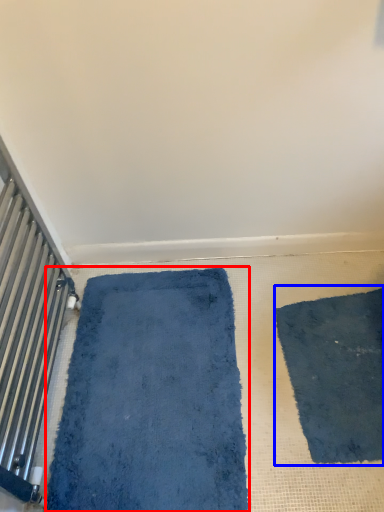
Question: Which object is further to the camera taking this photo, bath mat (highlighted by a red box) or mat (highlighted by a blue box)?

Choices:
 (A) bath mat
 (B) mat

Answer: (B)